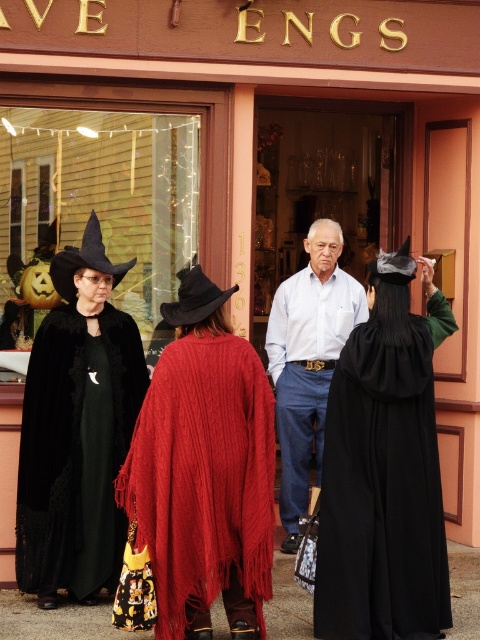
What do you see at coordinates (76, 429) in the screenshot?
I see `velvet black cape at left` at bounding box center [76, 429].

From the picture: Who is shorter, velvet black cape at left or black felt witch hat at left?

With less height is black felt witch hat at left.

Measure the distance between point (x=48, y=512) and camera.

Point (x=48, y=512) and camera are 5.73 meters apart.

You are a GUI agent. You are given a task and a screenshot of the screen. Output one action in this format:
    pyautogui.click(x=<x>, y=<y>)
    Task: Click on the velvet black cape at left
    
    Given the screenshot: What is the action you would take?
    pyautogui.click(x=76, y=429)

Where is `black velvet cape at center`? This screenshot has width=480, height=640. black velvet cape at center is located at coordinates (384, 470).

Which is behind, point (411, 605) or point (203, 452)?

The point (411, 605) is behind.

Image resolution: width=480 pixels, height=640 pixels. What are the coordinates of `black velvet cape at center` in the screenshot? It's located at (384, 470).

Who is more distant from viewer, [417,579] or [93,397]?

The point [93,397] is more distant.

Between black velvet cape at center and velvet black cape at left, which one appears on the right side from the viewer's perspective?

black velvet cape at center

Is point (367, 364) closer to viewer compared to point (108, 508)?

Yes.

This screenshot has height=640, width=480. I want to click on black velvet cape at center, so click(384, 470).